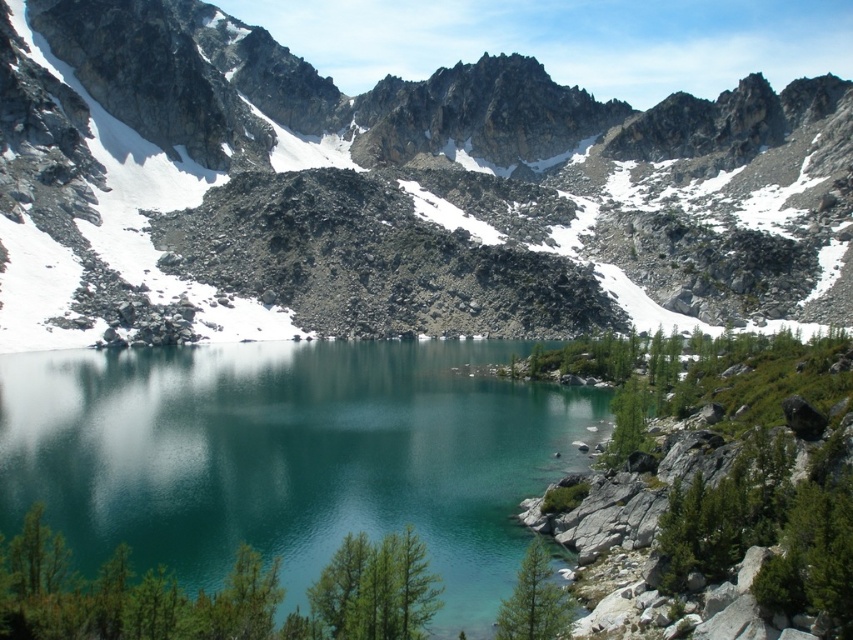
Question: Which object is farther from the camera taking this photo?

Choices:
 (A) teal glassy water at center
 (B) rocky gray mountain at center

Answer: (B)

Question: Which point appears closest to the camera in this image?

Choices:
 (A) (268, 352)
 (B) (701, 145)

Answer: (A)

Question: Does rocky gray mountain at center lie behind teal glassy water at center?

Choices:
 (A) yes
 (B) no

Answer: (A)

Question: Which object appears closest to the camera in this image?

Choices:
 (A) teal glassy water at center
 (B) rocky gray mountain at center

Answer: (A)

Question: Does rocky gray mountain at center have a greater width compared to teal glassy water at center?

Choices:
 (A) no
 (B) yes

Answer: (B)

Question: Is rocky gray mountain at center further to camera compared to teal glassy water at center?

Choices:
 (A) no
 (B) yes

Answer: (B)